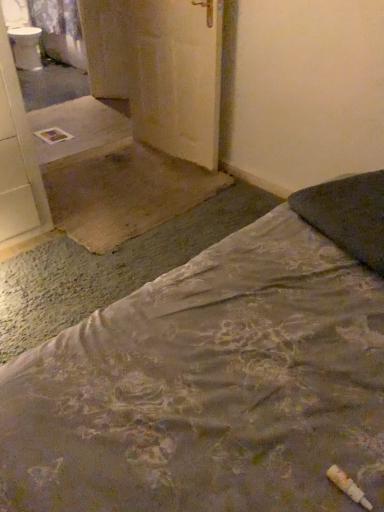
Question: Visually, is dark gray fabric pillow at upper right positioned to the left or to the right of floral fabric bed at lower right?

Choices:
 (A) right
 (B) left

Answer: (A)

Question: Would you say dark gray fabric pillow at upper right is inside or outside floral fabric bed at lower right?

Choices:
 (A) outside
 (B) inside

Answer: (B)

Question: Estimate the real-world distances between objects in this image. Which object is farther from the white glossy sink at upper left?

Choices:
 (A) floral fabric bed at lower right
 (B) dark gray fabric pillow at upper right
 (C) matte yellow door at center

Answer: (A)

Question: Which object is the farthest from the matte yellow door at center?

Choices:
 (A) floral fabric bed at lower right
 (B) dark gray fabric pillow at upper right
 (C) white glossy sink at upper left

Answer: (C)